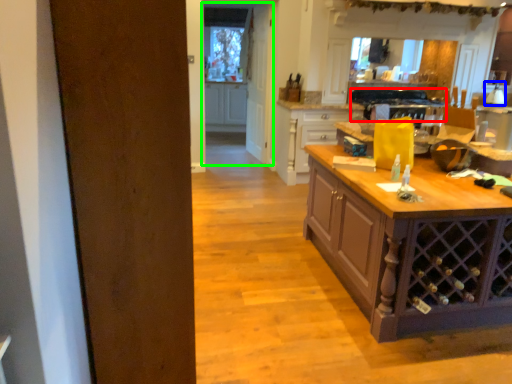
Question: Which is nearer to the oven (highlighted by a red box)? kitchen appliance (highlighted by a blue box) or glass door (highlighted by a green box).

Choices:
 (A) kitchen appliance
 (B) glass door

Answer: (A)